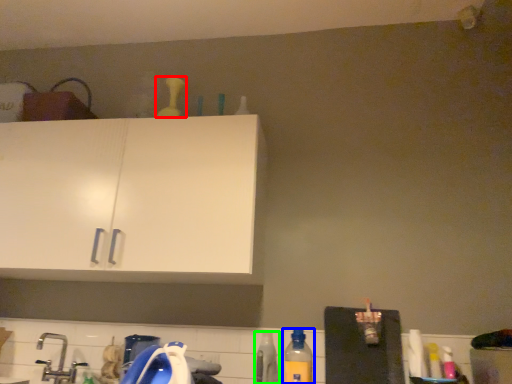
Question: Which is farther away from bottle (highlighted by a red box)? bottle (highlighted by a blue box) or bottle (highlighted by a green box)?

Choices:
 (A) bottle
 (B) bottle

Answer: (A)